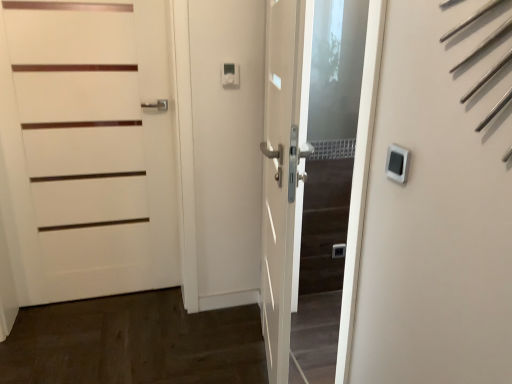
Question: From the image's perspective, is white plastic thermostat at upper right located beneath white matte door at center?

Choices:
 (A) yes
 (B) no

Answer: (B)

Question: From the image's perspective, is white plastic thermostat at upper right on top of white matte door at center?

Choices:
 (A) yes
 (B) no

Answer: (A)

Question: From a real-world perspective, is white plastic thermostat at upper right positioned under white matte door at center based on gravity?

Choices:
 (A) no
 (B) yes

Answer: (A)

Question: Can you confirm if white plastic thermostat at upper right is positioned to the right of white matte door at center?

Choices:
 (A) no
 (B) yes

Answer: (B)

Question: Is white plastic thermostat at upper right outside white matte door at center?

Choices:
 (A) yes
 (B) no

Answer: (A)

Question: Can white matte door at center be found inside white plastic thermostat at upper right?

Choices:
 (A) no
 (B) yes

Answer: (A)

Question: Is white matte door at center, the 1th door positioned from the right, positioned with its back to white matte door at left, the 1th door from the left?

Choices:
 (A) no
 (B) yes

Answer: (A)

Question: Is white matte door at center, the second door in the left-to-right sequence, behind white matte door at left, the 1th door from the left?

Choices:
 (A) no
 (B) yes

Answer: (A)

Question: Can you confirm if white matte door at center, the 1th door positioned from the right, is smaller than white matte door at left, the 1th door from the left?

Choices:
 (A) no
 (B) yes

Answer: (A)

Question: Is white matte door at center, the second door in the left-to-right sequence, closer to camera compared to white matte door at left, the second door positioned from the right?

Choices:
 (A) no
 (B) yes

Answer: (B)

Question: Can you confirm if white matte door at center, the second door in the left-to-right sequence, is shorter than white matte door at left, the 1th door from the left?

Choices:
 (A) no
 (B) yes

Answer: (B)

Question: Is white matte door at center, the second door in the left-to-right sequence, far away from white matte door at left, the second door positioned from the right?

Choices:
 (A) yes
 (B) no

Answer: (B)

Question: Can you confirm if white matte door at left, the 1th door from the left, is thinner than white matte door at center, the second door in the left-to-right sequence?

Choices:
 (A) yes
 (B) no

Answer: (A)